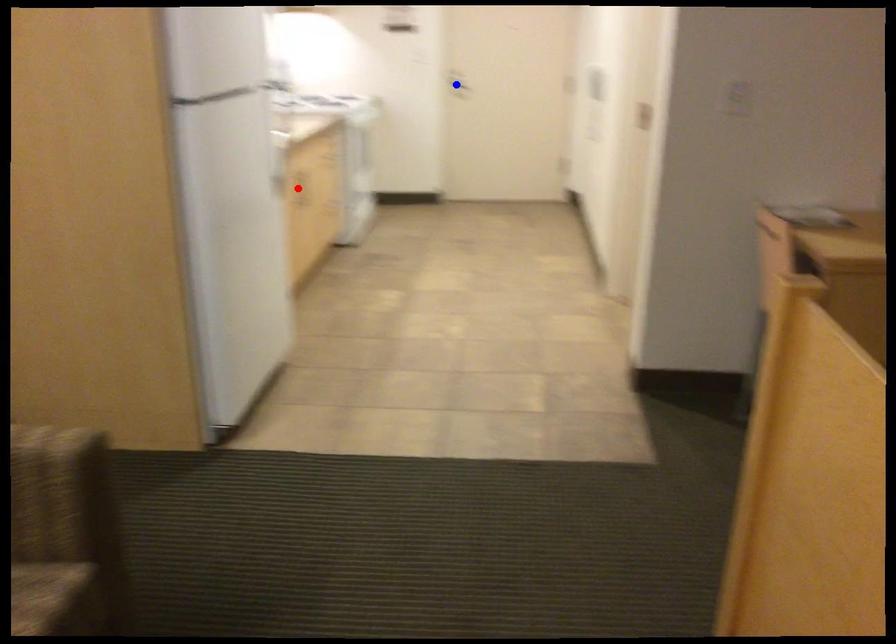
Question: In the image, two points are highlighted. Which point is nearer to the camera? Reply with the corresponding letter.

Choices:
 (A) blue point
 (B) red point

Answer: (B)